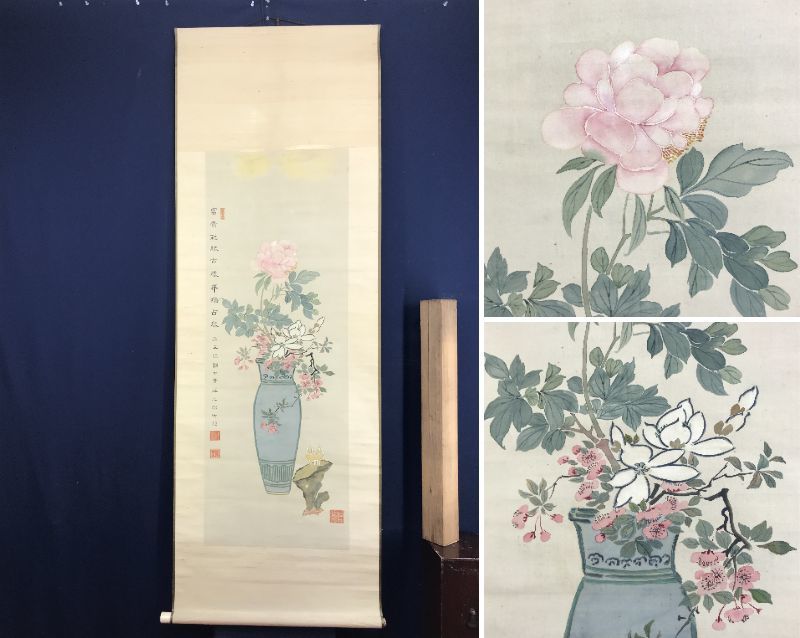
This screenshot has height=638, width=800. Find the location of `wall`. wall is located at coordinates (450, 172).